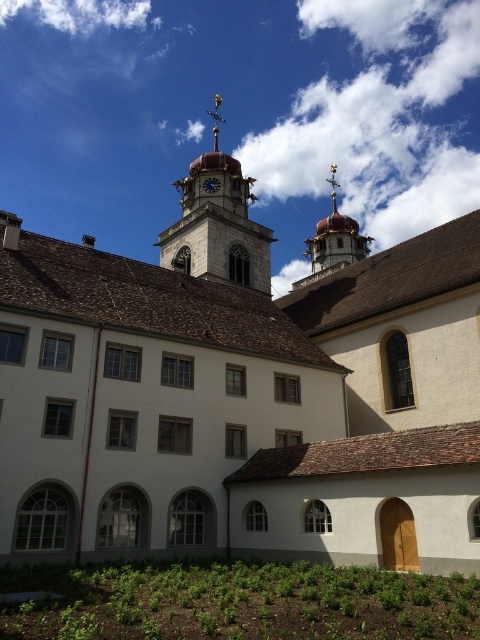
Is smooth stone clock tower at upper center shorter than shiny gold spire at upper center?

No.

The image size is (480, 640). Describe the element at coordinates (217, 224) in the screenshot. I see `smooth stone clock tower at upper center` at that location.

What do you see at coordinates (217, 224) in the screenshot? I see `smooth stone clock tower at upper center` at bounding box center [217, 224].

Where is `smooth stone clock tower at upper center`? The width and height of the screenshot is (480, 640). smooth stone clock tower at upper center is located at coordinates (217, 224).

Is smooth stone clock tower at upper center further to the viewer compared to blue painted wood clock at center?

That is False.

Who is more distant from viewer, (x=182, y=227) or (x=213, y=179)?

Positioned behind is point (x=213, y=179).

Find the location of a particular element. smooth stone clock tower at upper center is located at coordinates (217, 224).

Can you confirm if shiny gold spire at upper center is thinner than blue painted wood clock at center?

In fact, shiny gold spire at upper center might be wider than blue painted wood clock at center.

Who is positioned more to the left, shiny gold spire at upper center or blue painted wood clock at center?

From the viewer's perspective, blue painted wood clock at center appears more on the left side.

Who is more distant from viewer, [332,243] or [217,189]?

Positioned behind is point [332,243].

At what (x,y) coordinates should I click in order to perform the action: click on shiny gold spire at upper center. Please return your answer as a coordinate pair (x, y). Looking at the image, I should click on (336, 237).